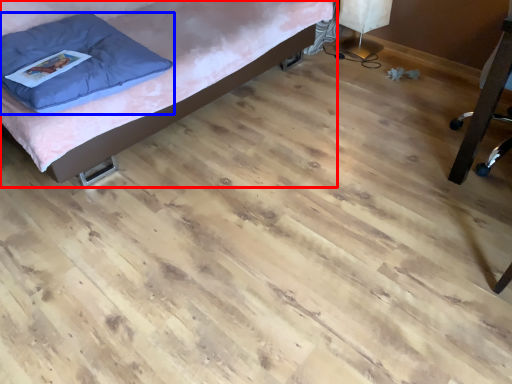
Question: Which object appears closest to the camera in this image, furniture (highlighted by a red box) or pillow (highlighted by a blue box)?

Choices:
 (A) furniture
 (B) pillow

Answer: (A)